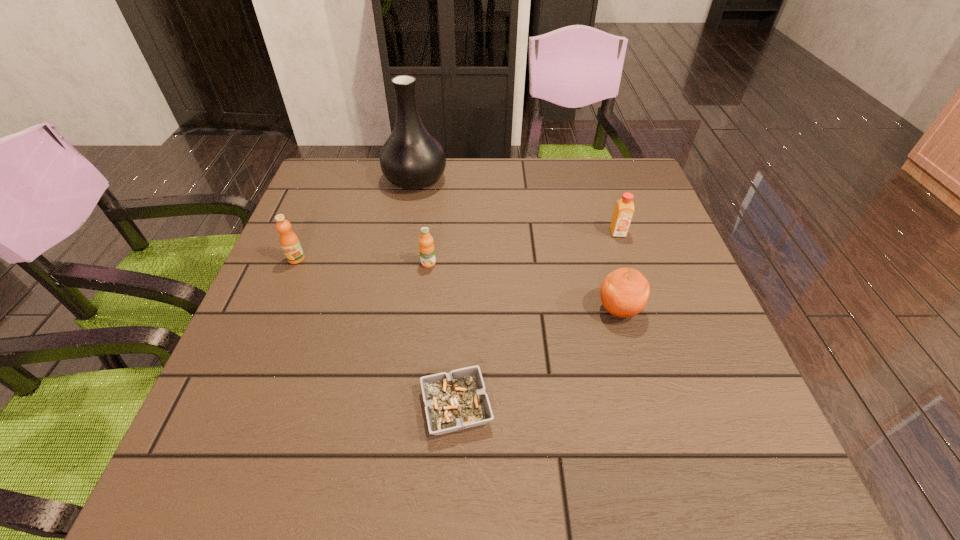
Identify the location of vacant space at the far edge. (523, 201).

In the image, there is a desktop. In order to click on vacant space at the near edge in this screenshot , I will do `click(455, 449)`.

In the image, there is a desktop. Identify the location of free space at the left edge. pos(211,426).

This screenshot has width=960, height=540. Find the location of `vacant area at the right edge`. vacant area at the right edge is located at coordinates (752, 424).

The width and height of the screenshot is (960, 540). I want to click on vacant space at the far left corner, so 321,177.

Where is `vacant space at the far right corner of the desktop`? vacant space at the far right corner of the desktop is located at coordinates (608, 205).

The height and width of the screenshot is (540, 960). Find the location of `free space between the leftmost object and the orange`. free space between the leftmost object and the orange is located at coordinates (458, 284).

Image resolution: width=960 pixels, height=540 pixels. I want to click on vacant region between the second orange juice from right to left and the second farthest object, so click(x=523, y=248).

The image size is (960, 540). Identify the location of empty space that is in between the ashtray and the second orange juice from left to right. (443, 335).

Where is `free space that is in between the fifth farthest object and the leftmost object`? The image size is (960, 540). free space that is in between the fifth farthest object and the leftmost object is located at coordinates (458, 284).